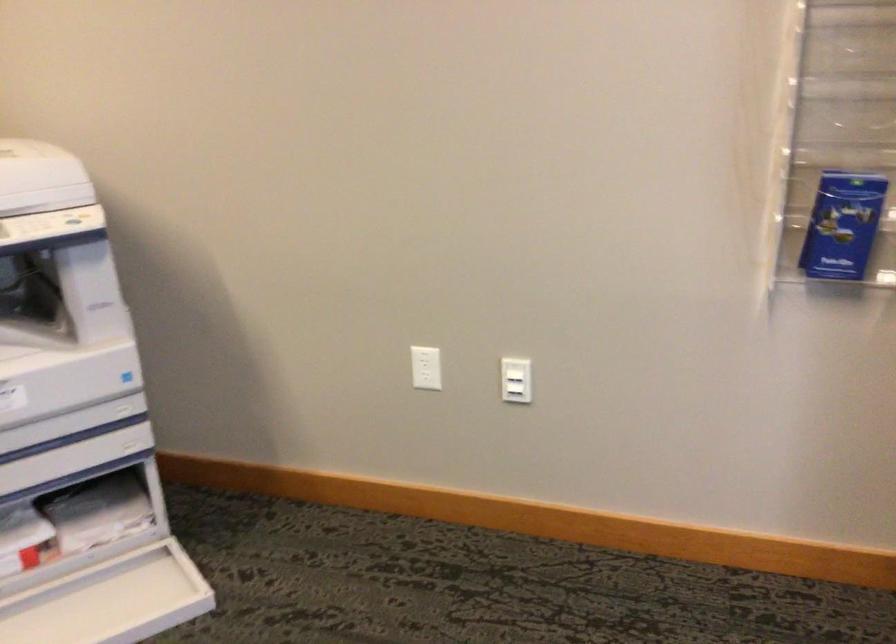
What do you see at coordinates (515, 381) in the screenshot? I see `a white light switch` at bounding box center [515, 381].